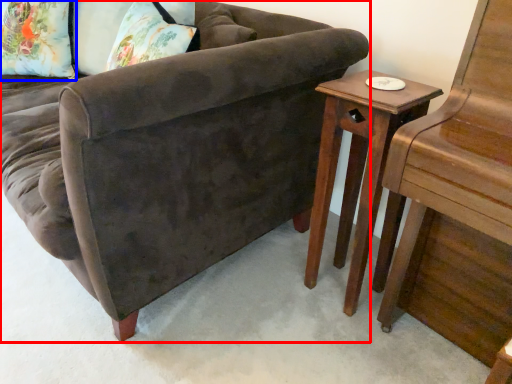
Question: Which of the following is the closest to the observer, studio couch (highlighted by a red box) or pillow (highlighted by a blue box)?

Choices:
 (A) studio couch
 (B) pillow

Answer: (A)